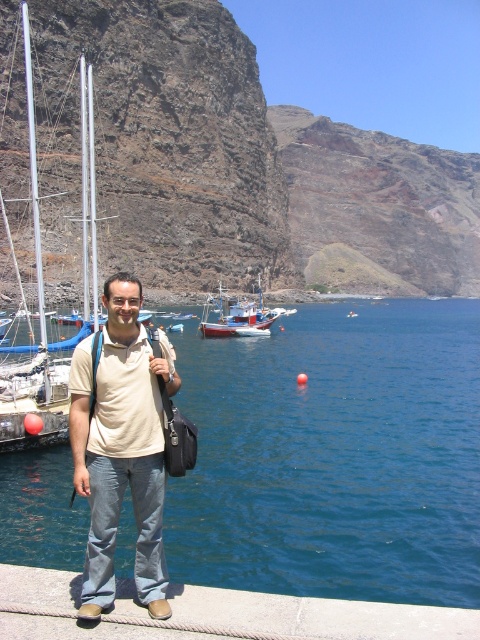
Question: Which point appears farthest from the camera in this image?

Choices:
 (A) (273, 317)
 (B) (86, 529)
 (C) (165, 627)

Answer: (A)

Question: Can you confirm if light beige cotton shirt at center is wider than wooden fishing boat at center?

Choices:
 (A) yes
 (B) no

Answer: (B)

Question: Which point is closer to the camera?

Choices:
 (A) (84, 449)
 (B) (381, 465)

Answer: (A)

Question: Among these points, which one is nearest to the camera?

Choices:
 (A) (118, 438)
 (B) (210, 328)

Answer: (A)

Question: Observing the image, what is the correct spatial positioning of light beige cotton shirt at center in reference to brushed metal boat at left?

Choices:
 (A) right
 (B) left

Answer: (A)

Question: Is light beige cotton shirt at center closer to the viewer compared to brushed metal boat at left?

Choices:
 (A) no
 (B) yes

Answer: (B)